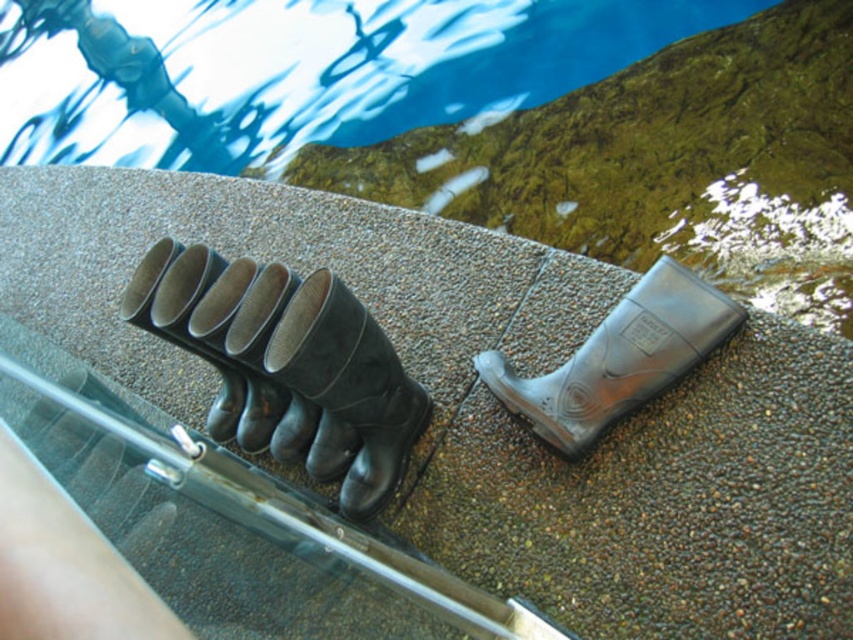
Measure the distance from black rubber boots at center to transparent rubber boot at center.

black rubber boots at center is 17.45 inches away from transparent rubber boot at center.

Which is below, black rubber boots at center or transparent rubber boot at center?

black rubber boots at center is lower down.

This screenshot has height=640, width=853. Find the location of `black rubber boots at center`. black rubber boots at center is located at coordinates (287, 365).